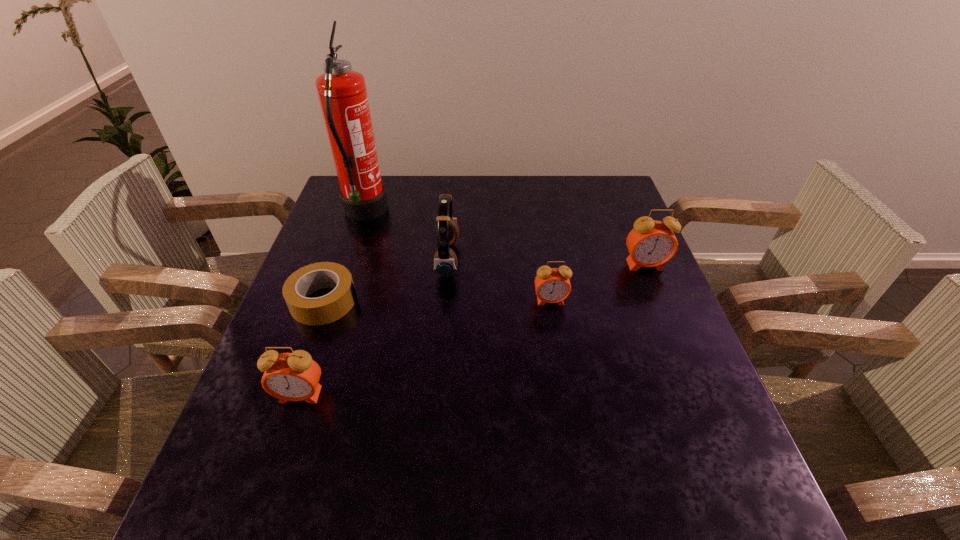
I want to click on vacant space situated 0.100m on the face of the leftmost alarm clock, so click(x=280, y=455).

Where is `free spot located 0.300m on the face of the fifth tallest object`? The height and width of the screenshot is (540, 960). free spot located 0.300m on the face of the fifth tallest object is located at coordinates (570, 421).

This screenshot has height=540, width=960. What are the coordinates of `free location located 0.070m on the face of the farthest alarm clock` in the screenshot? It's located at (656, 291).

Find the location of a particular element. The height and width of the screenshot is (540, 960). vacant space situated 0.280m on the front-facing side of the farthest object is located at coordinates [479, 213].

The width and height of the screenshot is (960, 540). I want to click on vacant space positioned at the edge of the shortest object, so click(504, 301).

I want to click on vacant space located 0.180m on the ear cup of the third object from right to left, so click(526, 259).

Find the location of a particular element. The height and width of the screenshot is (540, 960). object that is at the far edge is located at coordinates (342, 93).

I want to click on alarm clock at the left edge, so [294, 376].

In order to click on fire extinguisher that is at the left edge in this screenshot , I will do `click(342, 93)`.

You are a GUI agent. You are given a task and a screenshot of the screen. Output one action in this format:
    pyautogui.click(x=<x>, y=<y>)
    Task: Click on the duct tape present at the left edge
    This screenshot has width=960, height=540.
    Given the screenshot: What is the action you would take?
    pyautogui.click(x=326, y=309)